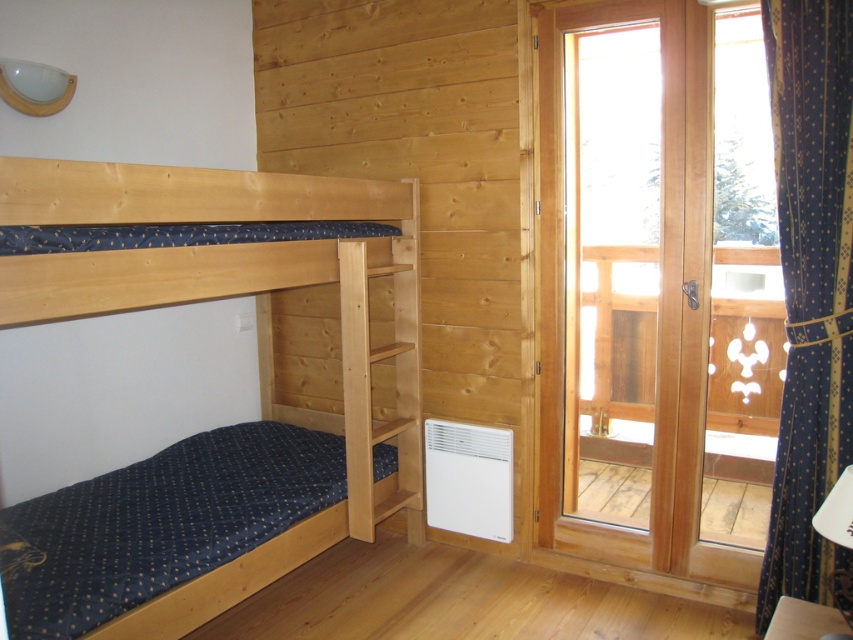
Who is lower down, natural wood bunk bed at left or blue textured curtain at right?

natural wood bunk bed at left is lower down.

Is natural wood bunk bed at left positioned behind blue textured curtain at right?

No, it is not.

The image size is (853, 640). I want to click on natural wood bunk bed at left, so click(231, 296).

This screenshot has height=640, width=853. I want to click on natural wood bunk bed at left, so click(x=231, y=296).

At what (x,y) coordinates should I click in order to perform the action: click on transparent wooden glass door at right. Please return your answer as a coordinate pair (x, y). Looking at the image, I should click on (657, 285).

In the scene shown: Is transparent wooden glass door at right to the left of natural wood bunk bed at left from the viewer's perspective?

Incorrect, transparent wooden glass door at right is not on the left side of natural wood bunk bed at left.

This screenshot has width=853, height=640. What are the coordinates of `transparent wooden glass door at right` in the screenshot? It's located at (657, 285).

Which is above, transparent wooden glass door at right or blue textured curtain at right?

transparent wooden glass door at right is above.

Does point (689, 1) come closer to viewer compared to point (805, 440)?

That is False.

The height and width of the screenshot is (640, 853). Find the location of `transparent wooden glass door at right`. transparent wooden glass door at right is located at coordinates (657, 285).